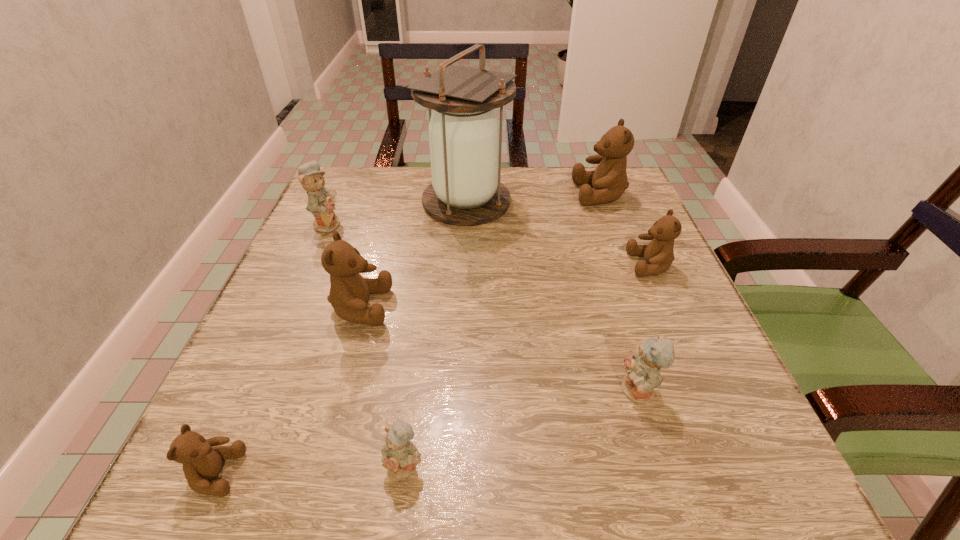
You are a GUI agent. You are given a task and a screenshot of the screen. Output one action in this format:
    pyautogui.click(x=<x>, y=<y>)
    Task: Click on the lantern
    
    Given the screenshot: What is the action you would take?
    pyautogui.click(x=465, y=139)

At what (x,y) coordinates should I click in order to perform the action: click on the biggest brown teddy bear. Please return your answer as a coordinate pair (x, y). This screenshot has width=960, height=540. Looking at the image, I should click on (609, 180).

Where is `the farthest brown teddy bear`? The height and width of the screenshot is (540, 960). the farthest brown teddy bear is located at coordinates pyautogui.click(x=609, y=180).

At what (x,y) coordinates should I click in order to perform the action: click on the second biggest brown teddy bear. Please return your answer as a coordinate pair (x, y). The height and width of the screenshot is (540, 960). Looking at the image, I should click on (349, 293).

I want to click on the fifth farthest object, so click(349, 293).

What are the coordinates of `the farthest blue teddy bear` in the screenshot? It's located at (321, 204).

This screenshot has width=960, height=540. Identify the location of the biggest blue teddy bear. (321, 204).

Identify the location of the second farthest blue teddy bear. (643, 371).

Where is `the sixth farthest object`? This screenshot has width=960, height=540. the sixth farthest object is located at coordinates (643, 371).

Locate an element on the screen. the third biggest brown teddy bear is located at coordinates coord(659,254).